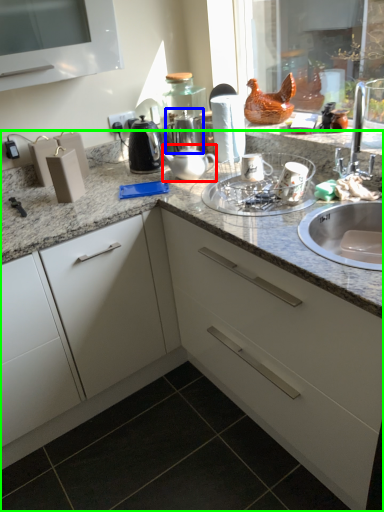
Question: Which object is positioned farthest from tea pot (highlighted by a red box)? Select from tea pot (highlighted by a blue box) and countertop (highlighted by a green box).

Choices:
 (A) tea pot
 (B) countertop

Answer: (B)